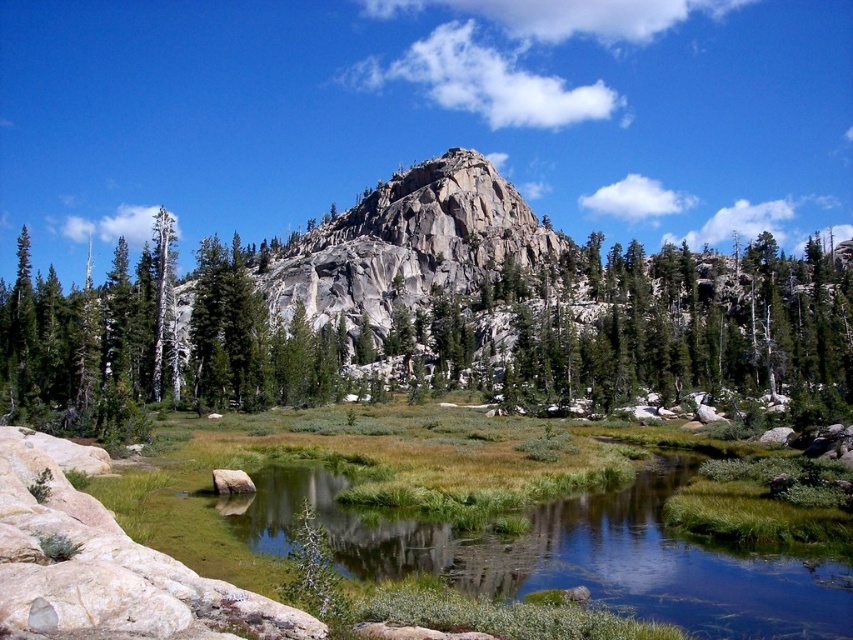
In the scene shown: You are standing at the edge of the green grassy lake at center and want to reach the smooth gray rock at center. Which direction should you move to get closer to the rock?

The smooth gray rock at center is further away than the green grassy lake at center, so you should move forward away from the lake to reach the rock.

You are standing at the edge of the green grassy lake at center and want to reach the smooth gray rock at center. Which direction should you move to get there?

The green grassy lake at center is positioned on the right side of the smooth gray rock at center, so you should move to your left to reach the smooth gray rock at center.